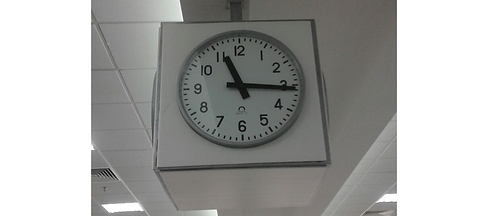
Locate an element on the screen. silver frame is located at coordinates (234, 146).